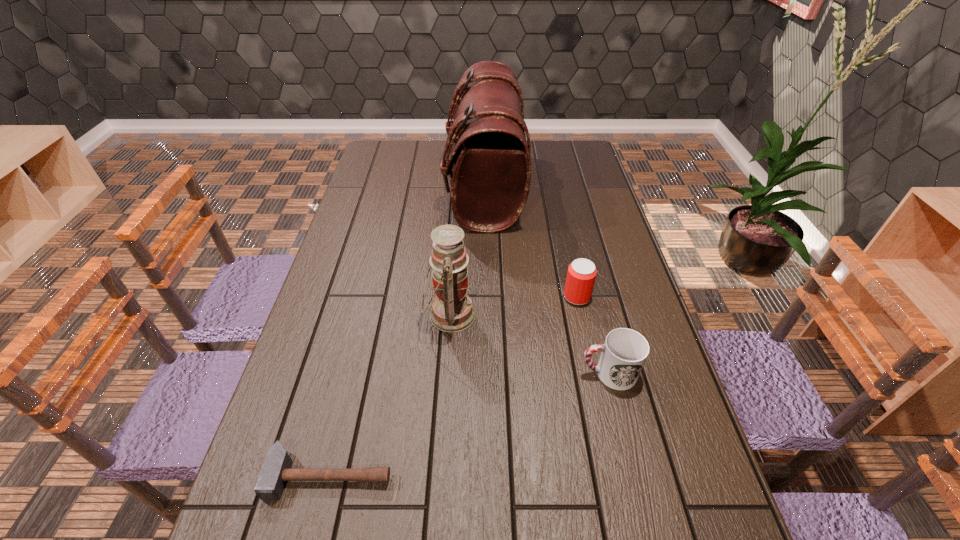
You are a GUI agent. You are given a task and a screenshot of the screen. Output one action in this format:
    pyautogui.click(x=<x>, y=<y>)
    Task: Click on the blank space located 0.050m on the back of the oil lamp
    The height and width of the screenshot is (540, 960).
    Given the screenshot: What is the action you would take?
    pyautogui.click(x=452, y=278)

Where is `vacant space situated on the front of the beer can`? The height and width of the screenshot is (540, 960). vacant space situated on the front of the beer can is located at coordinates (593, 370).

You are a GUI agent. You are given a task and a screenshot of the screen. Output one action in this format:
    pyautogui.click(x=<x>, y=<y>)
    Task: Click on the free space located 0.250m on the handle side of the second nearest object
    This screenshot has height=540, width=960.
    Given the screenshot: What is the action you would take?
    pyautogui.click(x=477, y=373)

This screenshot has width=960, height=540. Identify the location of free space located 0.060m on the handle side of the second nearest object. click(x=555, y=373).

The image size is (960, 540). What are the coordinates of `free spot located on the handle side of the second nearest object` in the screenshot? It's located at (419, 373).

I want to click on object located in the far edge section of the desktop, so click(491, 160).

This screenshot has height=540, width=960. What are the coordinates of `object located at the left edge` in the screenshot? It's located at (275, 471).

In order to click on beer can located at the right edge in this screenshot , I will do `click(581, 275)`.

Identify the location of cup that is at the right edge. (624, 352).

Image resolution: width=960 pixels, height=540 pixels. I want to click on free space at the far edge of the desktop, so click(x=440, y=163).